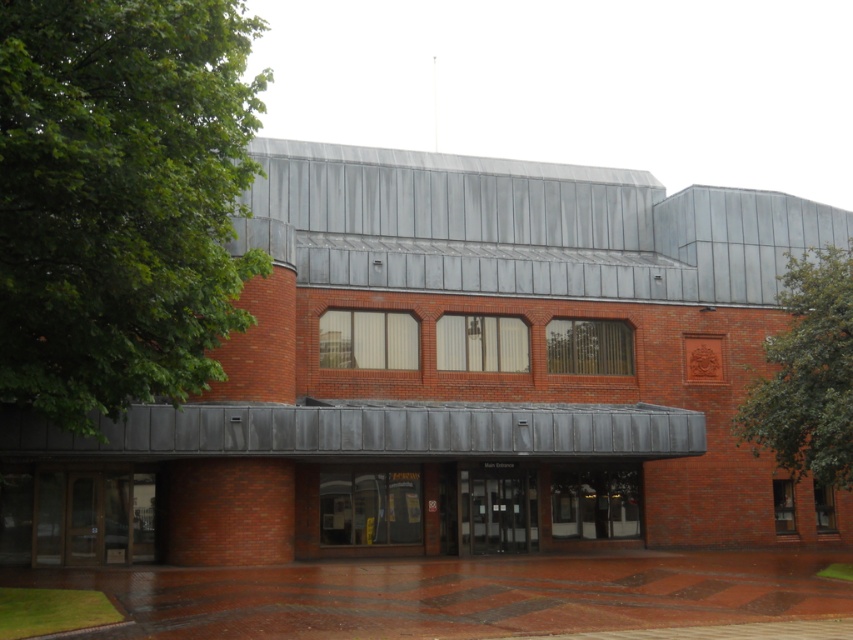
Question: Among these points, which one is farthest from the camera?

Choices:
 (A) (483, 525)
 (B) (602, 515)
 (C) (157, 384)

Answer: (B)

Question: Observing the image, what is the correct spatial positioning of green leafy tree at upper right in reference to transparent glass door at center?

Choices:
 (A) left
 (B) right

Answer: (B)

Question: Can you confirm if green leafy tree at upper right is wider than black glass doors at center?

Choices:
 (A) no
 (B) yes

Answer: (A)

Question: Among these objects, which one is farthest from the camera?

Choices:
 (A) green leafy tree at upper right
 (B) matte glass doors at center

Answer: (A)

Question: Which of the following is the farthest from the observer?

Choices:
 (A) (x=113, y=156)
 (B) (x=807, y=285)
 (C) (x=321, y=477)
 (D) (x=467, y=538)

Answer: (D)

Question: Is the position of green leafy tree at upper right more distant than that of black glass doors at center?

Choices:
 (A) yes
 (B) no

Answer: (A)